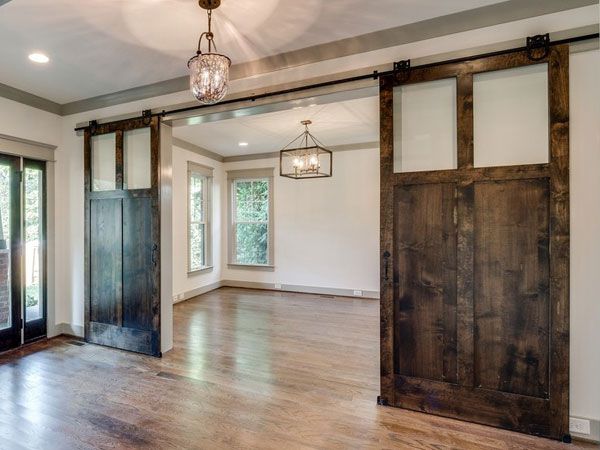
Where is `small windows on wooden doors`? The image size is (600, 450). small windows on wooden doors is located at coordinates (104, 164), (136, 155), (423, 138), (533, 122).